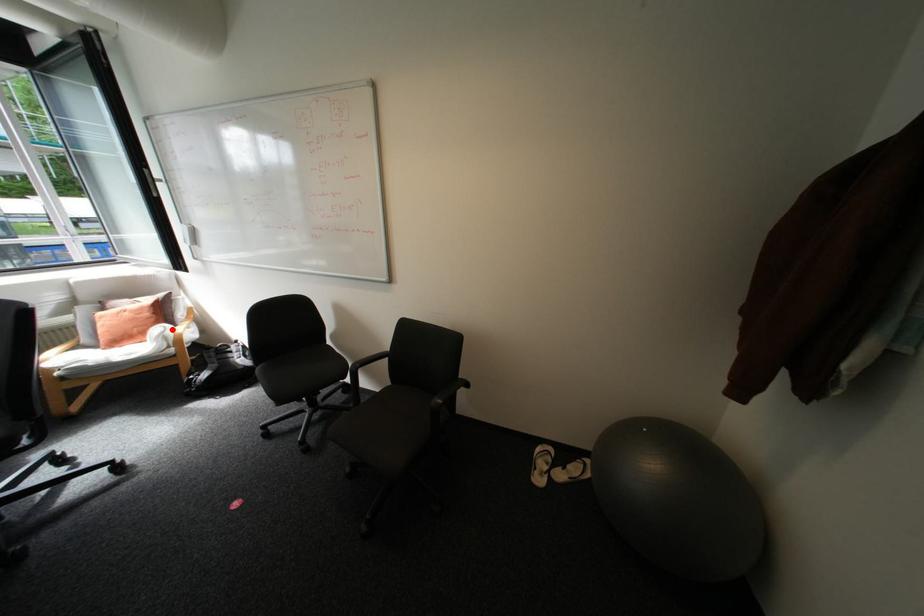
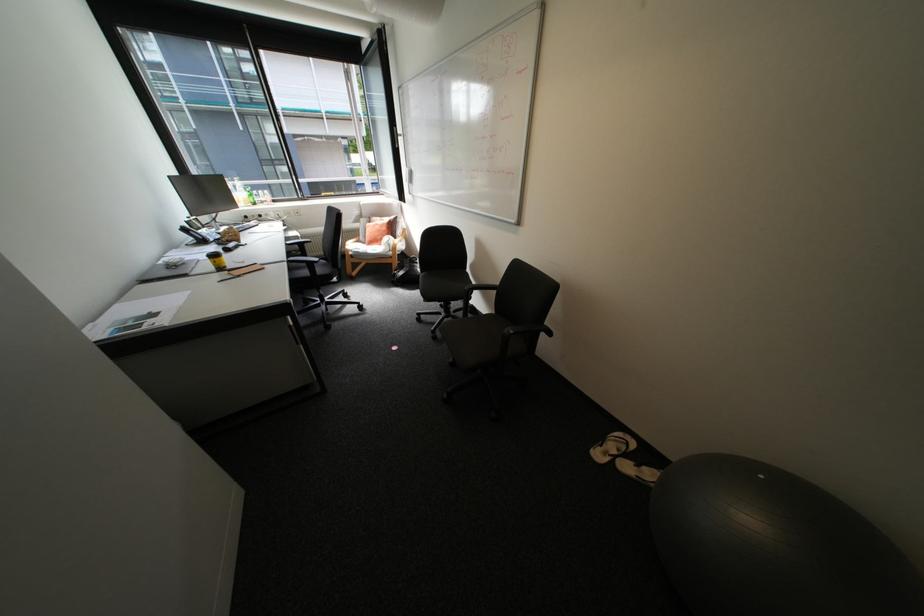
Question: I am providing you with two images of the same scene from different viewpoints. Image1 has a red point marked. In image2, the corresponding 3D location appears at what relative position? Reply with the corresponding letter.

Choices:
 (A) Closer
 (B) Farther

Answer: (A)